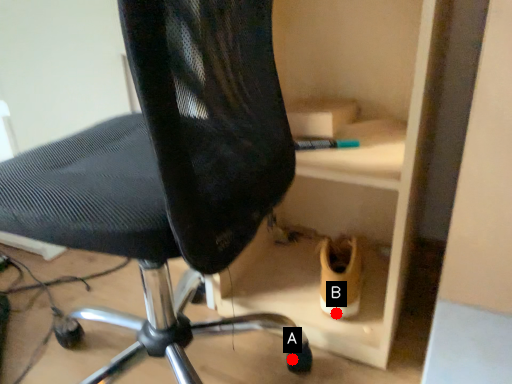
Question: Two points are circled on the image, labeled by A and B beside each circle. Which of the following is the farthest from the observer?

Choices:
 (A) A is further
 (B) B is further

Answer: (B)